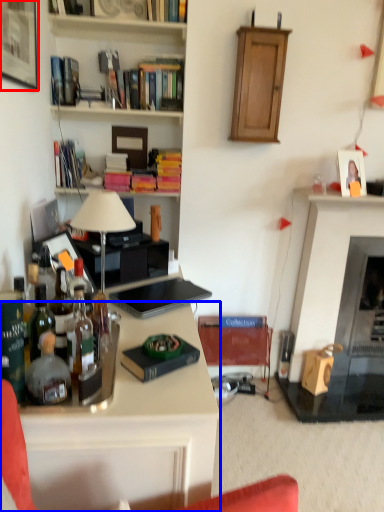
Question: Among these objects, which one is nearest to the camera, picture frame (highlighted by a red box) or desk (highlighted by a blue box)?

Choices:
 (A) picture frame
 (B) desk

Answer: (B)